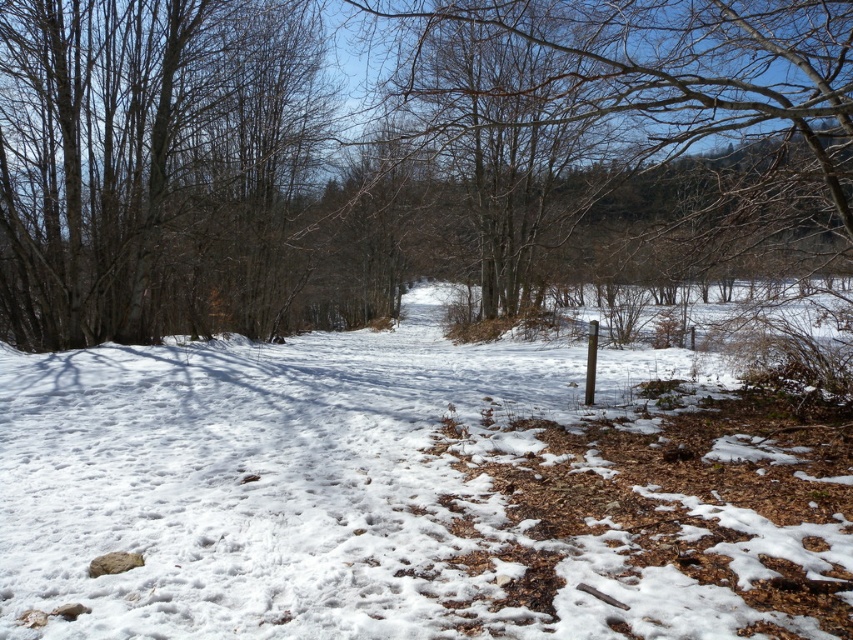
Which of these two, brown/dry wood at center or white powdery snow at center, stands shorter?

Standing shorter between the two is white powdery snow at center.

Is brown/dry wood at center smaller than white powdery snow at center?

Incorrect, brown/dry wood at center is not smaller in size than white powdery snow at center.

What do you see at coordinates (404, 157) in the screenshot? The image size is (853, 640). I see `brown/dry wood at center` at bounding box center [404, 157].

Identify the location of brown/dry wood at center. (404, 157).